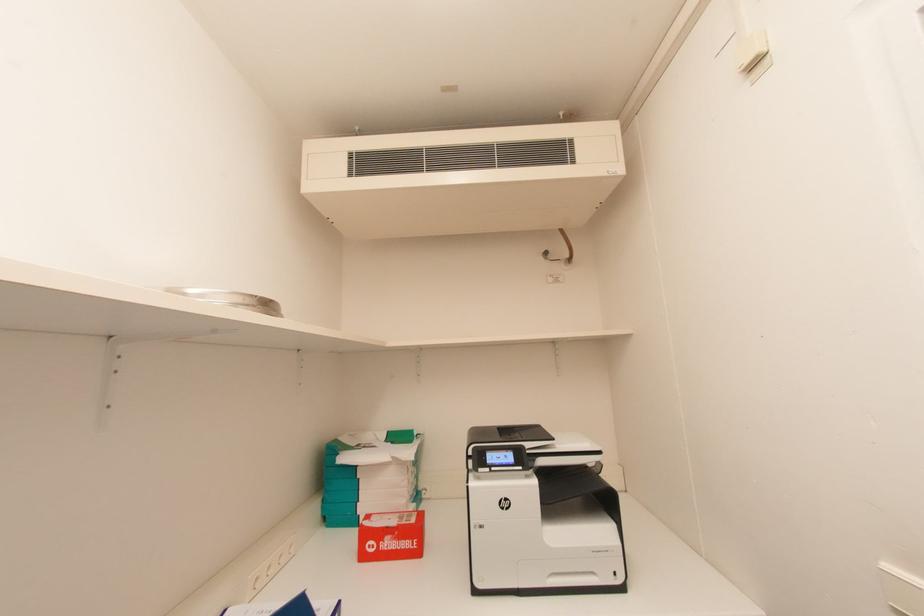
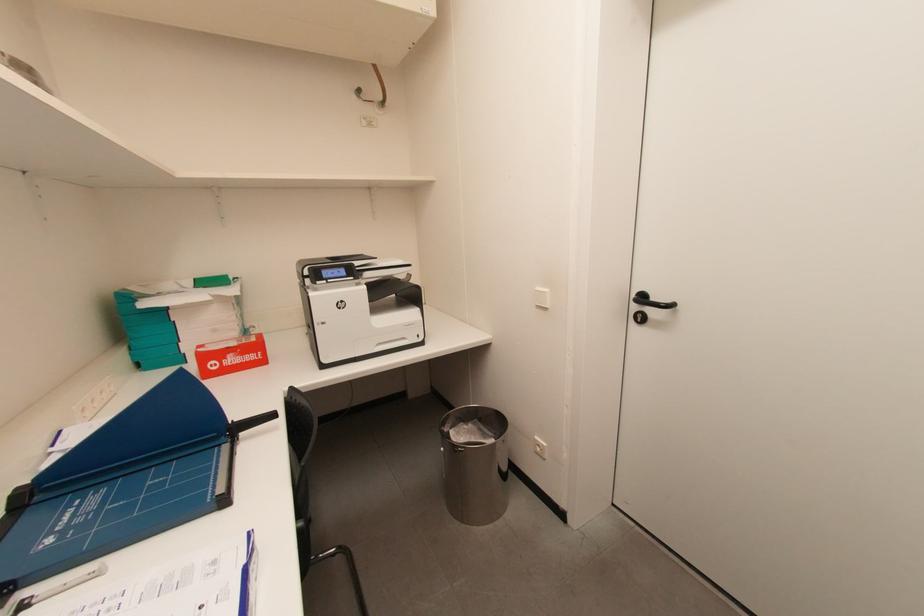
The images are taken continuously from a first-person perspective. In which direction is your viewpoint rotating?

The camera rotated toward right-down.